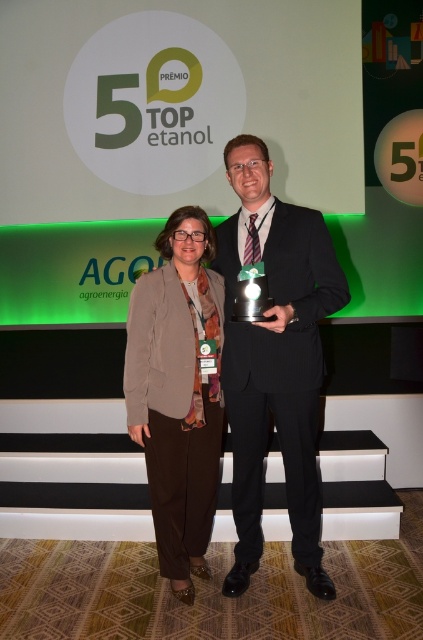
Does black pinstripe suit at center lie behind brown fabric jacket at center?

No, it is in front of brown fabric jacket at center.

Looking at this image, who is more forward, [244,465] or [175,298]?

Point [175,298]

Is point (247, 568) positioned in front of point (167, 372)?

That is False.

This screenshot has width=423, height=640. What are the coordinates of `black pinstripe suit at center` in the screenshot? It's located at (274, 358).